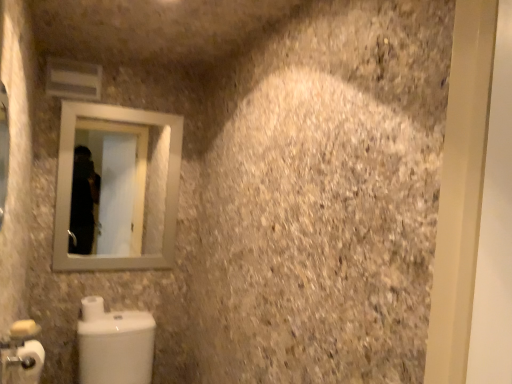
Question: Is white matte toilet paper at lower left, acting as the 1th toilet paper starting from the back, located outside white matte toilet paper at lower left, which is the second toilet paper in back-to-front order?

Choices:
 (A) no
 (B) yes

Answer: (B)

Question: Does white matte toilet paper at lower left, arranged as the second toilet paper when viewed from the front, lie behind white matte toilet paper at lower left, which is the second toilet paper in back-to-front order?

Choices:
 (A) yes
 (B) no

Answer: (A)

Question: Can you see white matte toilet paper at lower left, acting as the 1th toilet paper starting from the back, touching white matte toilet paper at lower left, which is the second toilet paper in back-to-front order?

Choices:
 (A) yes
 (B) no

Answer: (B)

Question: Considering the relative sizes of white matte toilet paper at lower left, acting as the 1th toilet paper starting from the back, and white matte toilet paper at lower left, the first toilet paper in the front-to-back sequence, in the image provided, is white matte toilet paper at lower left, acting as the 1th toilet paper starting from the back, shorter than white matte toilet paper at lower left, the first toilet paper in the front-to-back sequence,?

Choices:
 (A) no
 (B) yes

Answer: (A)

Question: Considering the relative positions of white matte toilet paper at lower left, acting as the 1th toilet paper starting from the back, and white matte toilet paper at lower left, the first toilet paper in the front-to-back sequence, in the image provided, is white matte toilet paper at lower left, acting as the 1th toilet paper starting from the back, to the right of white matte toilet paper at lower left, the first toilet paper in the front-to-back sequence, from the viewer's perspective?

Choices:
 (A) no
 (B) yes

Answer: (A)

Question: From a real-world perspective, is white glossy toilet at lower left positioned above or below silver metallic mirror at upper left?

Choices:
 (A) below
 (B) above

Answer: (A)

Question: Is white glossy toilet at lower left to the left or to the right of silver metallic mirror at upper left in the image?

Choices:
 (A) left
 (B) right

Answer: (B)

Question: In terms of height, does white glossy toilet at lower left look taller or shorter compared to silver metallic mirror at upper left?

Choices:
 (A) short
 (B) tall

Answer: (A)

Question: Considering the positions of white glossy toilet at lower left and silver metallic mirror at upper left in the image, is white glossy toilet at lower left wider or thinner than silver metallic mirror at upper left?

Choices:
 (A) wide
 (B) thin

Answer: (A)

Question: Is white matte toilet paper at lower left, acting as the 1th toilet paper starting from the back, wider or thinner than silver metallic mirror at upper left?

Choices:
 (A) thin
 (B) wide

Answer: (B)

Question: From a real-world perspective, is white matte toilet paper at lower left, arranged as the second toilet paper when viewed from the front, above or below silver metallic mirror at upper left?

Choices:
 (A) below
 (B) above

Answer: (A)

Question: Is white matte toilet paper at lower left, arranged as the second toilet paper when viewed from the front, situated inside silver metallic mirror at upper left or outside?

Choices:
 (A) inside
 (B) outside

Answer: (B)

Question: In terms of height, does white matte toilet paper at lower left, arranged as the second toilet paper when viewed from the front, look taller or shorter compared to silver metallic mirror at upper left?

Choices:
 (A) tall
 (B) short

Answer: (B)

Question: In terms of height, does white matte toilet paper at lower left, arranged as the second toilet paper when viewed from the front, look taller or shorter compared to white glossy toilet at lower left?

Choices:
 (A) short
 (B) tall

Answer: (A)

Question: From the image's perspective, is white matte toilet paper at lower left, arranged as the second toilet paper when viewed from the front, located above or below white glossy toilet at lower left?

Choices:
 (A) below
 (B) above

Answer: (B)